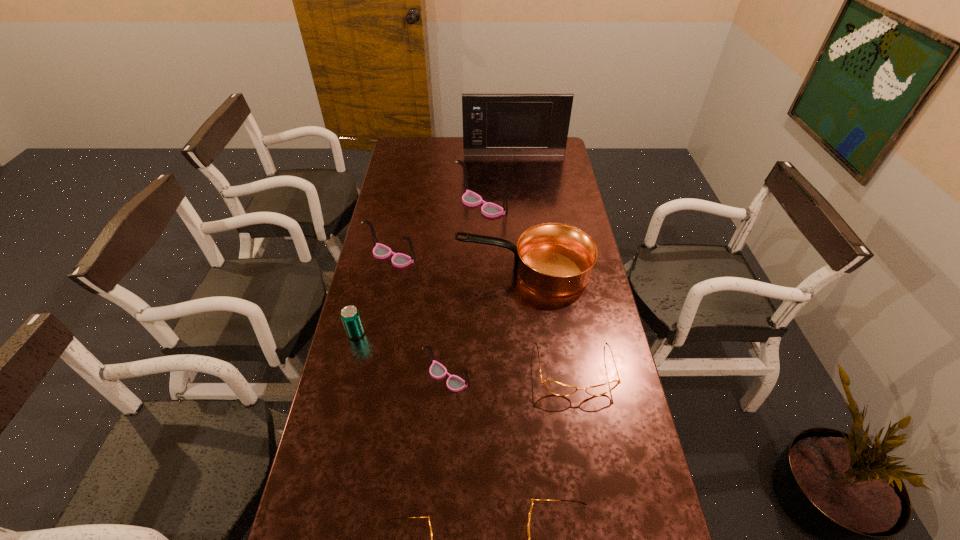
Locate an element on the screen. Image resolution: width=960 pixels, height=540 pixels. teal beer can is located at coordinates (350, 316).

You are a GUI agent. You are given a task and a screenshot of the screen. Output one action in this format:
    pyautogui.click(x=<x>, y=<y>)
    Task: Click on the farthest gold spectacles
    
    Given the screenshot: What is the action you would take?
    pyautogui.click(x=553, y=387)

At what (x,y) coordinates should I click in order to perform the action: click on the biggest gold spectacles. Please return your answer as a coordinate pair (x, y). This screenshot has width=960, height=540. Looking at the image, I should click on (553, 387).

Image resolution: width=960 pixels, height=540 pixels. Find the location of `vacant region located on the front panel of the tallest object`. vacant region located on the front panel of the tallest object is located at coordinates (516, 173).

This screenshot has width=960, height=540. Find the location of `free space located 0.050m on the front of the farthest spectacles`. free space located 0.050m on the front of the farthest spectacles is located at coordinates (482, 227).

Identify the location of vacant position located 0.070m on the handle side of the frying pan. (438, 269).

The width and height of the screenshot is (960, 540). What are the coordinates of `free space located on the handle side of the frying pan` in the screenshot? It's located at (419, 269).

The width and height of the screenshot is (960, 540). What are the coordinates of `free space located 0.180m on the handle side of the frying pan` in the screenshot? It's located at (408, 269).

Locate an element on the screen. The image size is (960, 540). vacant space located 0.400m on the back of the fifth nearest spectacles is located at coordinates (406, 185).

Identify the location of free space located on the right of the nearest pink spectacles. (557, 377).